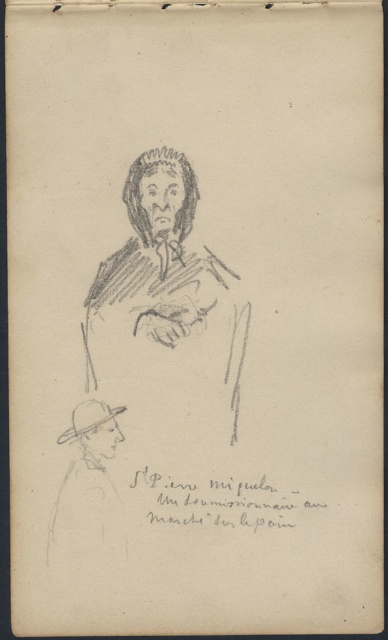
Looking at the pencil sketch on aged paper, you notice two charcoal sketches. The first is the charcoal sketch figure at center, and the second is the charcoal sketch of man at bottom left. Which of these two figures is positioned to the right side of the other?

The charcoal sketch figure at center is to the right of charcoal sketch of man at bottom left.

From the picture: Based on the scene description, if you were to draw a vertical line from the charcoal sketch figure at center downward, would it intersect the charcoal sketch of man at bottom left?

The charcoal sketch figure at center is above the charcoal sketch of man at bottom left, so a vertical line drawn downward from the center figure would intersect the bottom left man.

You are an art student who needs to hang two charcoal sketches on a wall. The first is the charcoal sketch figure at center and the second is the charcoal sketch of man at bottom left. If the wall has a space of 25 centimeters between two hooks, will both sketches fit with their current spacing?

The charcoal sketch figure at center is 20.92 centimeters from charcoal sketch of man at bottom left, so yes, both sketches will fit on the wall with the 25 centimeter spacing between the hooks since the required distance is less than the available space.